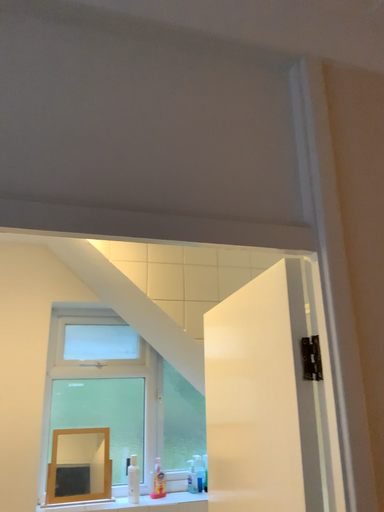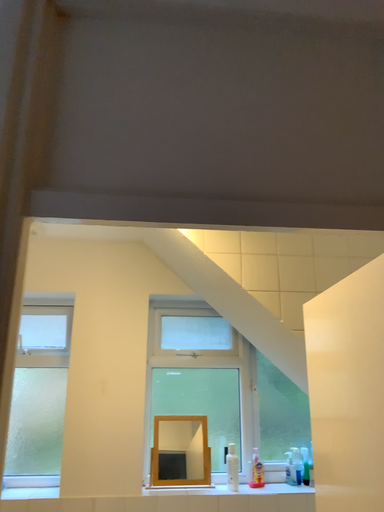
Question: How did the camera likely rotate when shooting the video?

Choices:
 (A) rotated right
 (B) rotated left

Answer: (B)